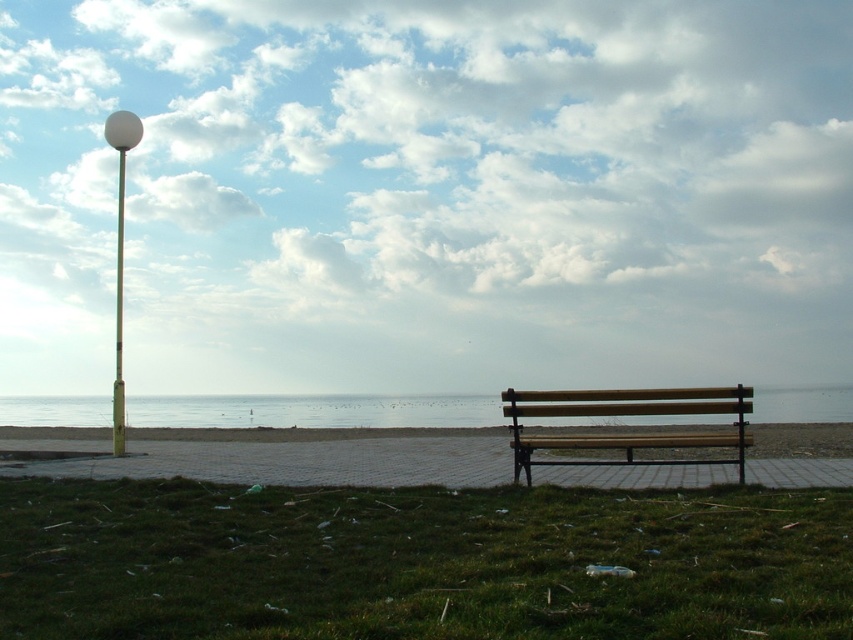
Question: Can you confirm if green grass at lower center is smaller than wooden bench at center?

Choices:
 (A) no
 (B) yes

Answer: (B)

Question: Is wooden bench at right below white glossy lamp post at upper left?

Choices:
 (A) yes
 (B) no

Answer: (A)

Question: Which point appears farthest from the camera in this image?

Choices:
 (A) (x=120, y=408)
 (B) (x=193, y=435)
 (C) (x=335, y=401)

Answer: (C)

Question: Which of the following is the closest to the observer?

Choices:
 (A) (309, 451)
 (B) (676, 440)

Answer: (B)

Question: Is wooden bench at right smaller than white glossy lamp post at upper left?

Choices:
 (A) no
 (B) yes

Answer: (B)

Question: Considering the real-world distances, which object is farthest from the wooden bench at right?

Choices:
 (A) metallic pole at left
 (B) green grass at lower center

Answer: (B)